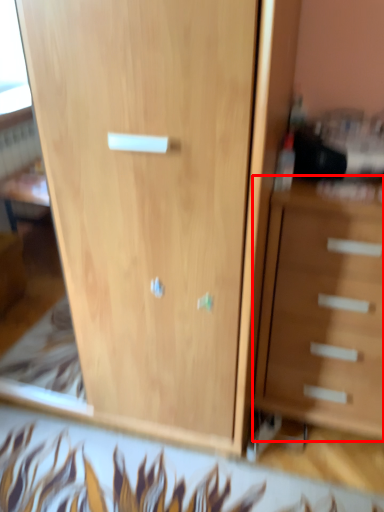
Question: From the image's perspective, where is chest of drawers (annotated by the red box) located relative to cupboard?

Choices:
 (A) below
 (B) above

Answer: (A)